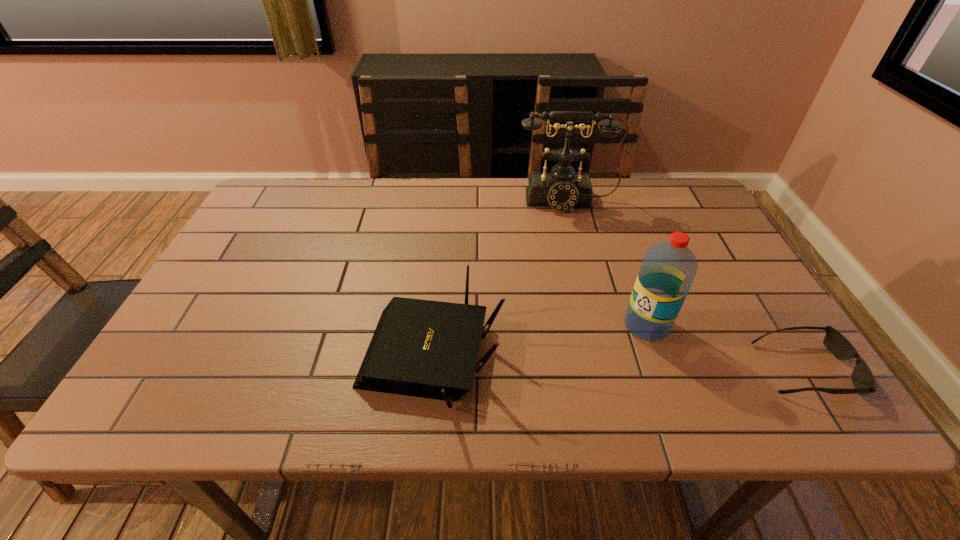
The image size is (960, 540). What are the coordinates of `the leftmost object` in the screenshot? It's located at (422, 348).

At what (x,y) coordinates should I click in order to perform the action: click on router. Please return your answer as a coordinate pair (x, y). This screenshot has width=960, height=540. Looking at the image, I should click on (422, 348).

At what (x,y) coordinates should I click in order to perform the action: click on the shortest object. Please return your answer as a coordinate pair (x, y). This screenshot has width=960, height=540. Looking at the image, I should click on (862, 377).

Identify the location of the rightmost object. (862, 377).

Identify the location of telephone. (562, 189).

At what (x,y) coordinates should I click in order to perform the action: click on water bottle. Please return your answer as a coordinate pair (x, y). Image resolution: width=960 pixels, height=540 pixels. Looking at the image, I should click on (668, 269).

This screenshot has height=540, width=960. I want to click on vacant space located 0.340m on the left of the router, so click(195, 359).

The width and height of the screenshot is (960, 540). Identify the location of vacant space located 0.260m on the dial of the telephone. (578, 275).

At what (x,y) coordinates should I click in order to perform the action: click on vacant space positioned on the dial of the telephone. Please return your answer as a coordinate pair (x, y). Looking at the image, I should click on (570, 231).

Locate an element on the screen. This screenshot has width=960, height=540. free space located on the dial of the telephone is located at coordinates (584, 315).